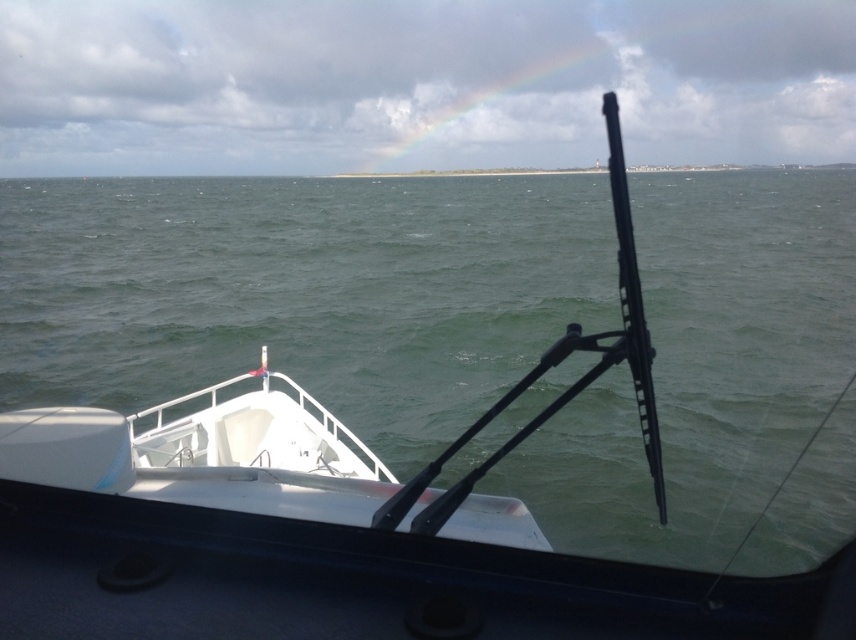
You are a sailor trying to navigate through the green matte water at center and the white matte boat at lower left. Which object is wider from your current position?

The green matte water at center might be wider than white matte boat at lower left according to the description.